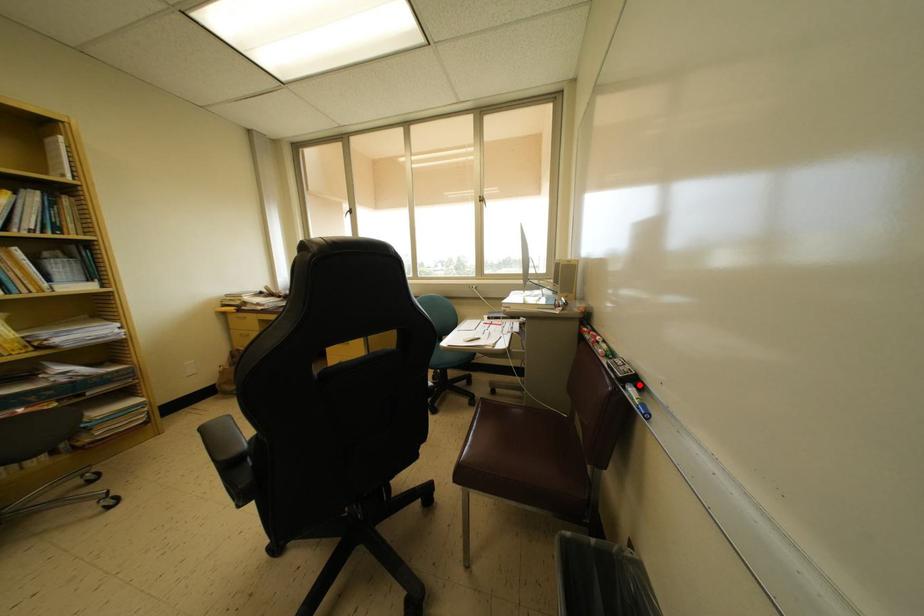
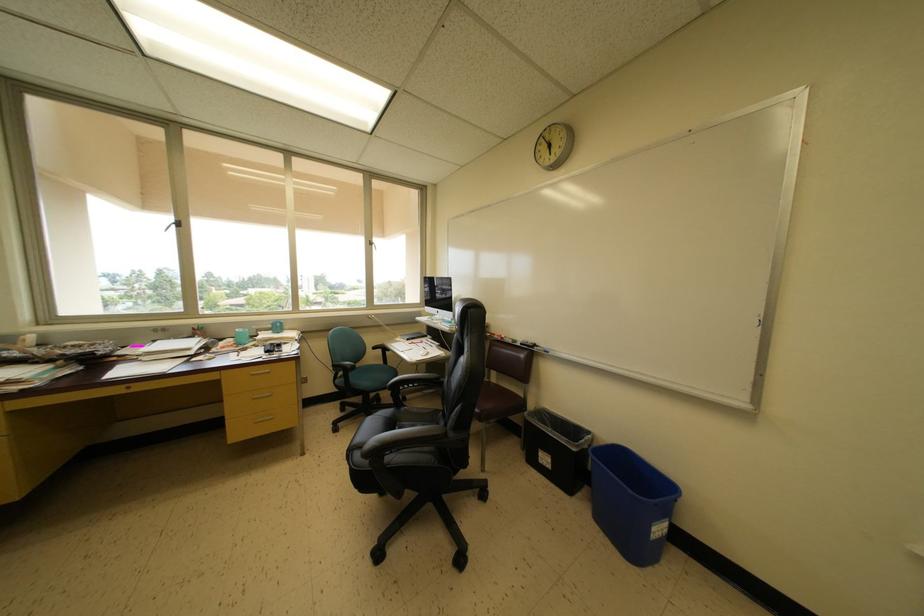
Find the pixel in the second image that matches the highlighted location in the first image.

(539, 350)